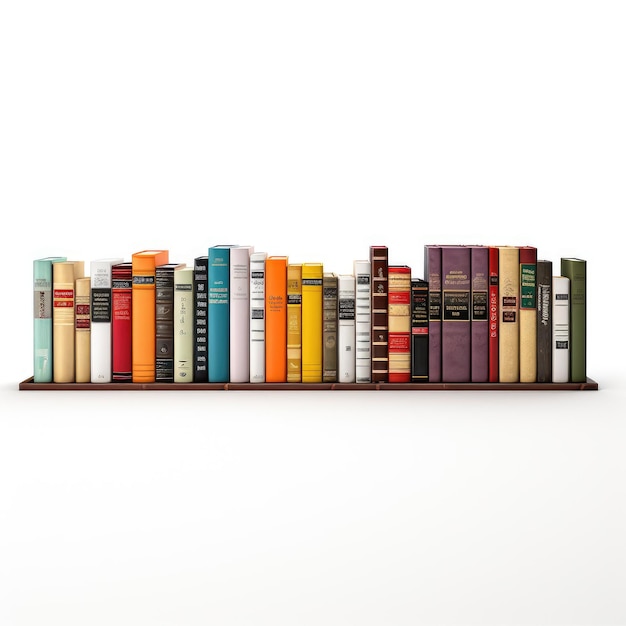
Locate an element on the screen. The image size is (626, 626). purple and orange books is located at coordinates click(x=144, y=324), click(x=277, y=314), click(x=436, y=332), click(x=454, y=337), click(x=478, y=341).